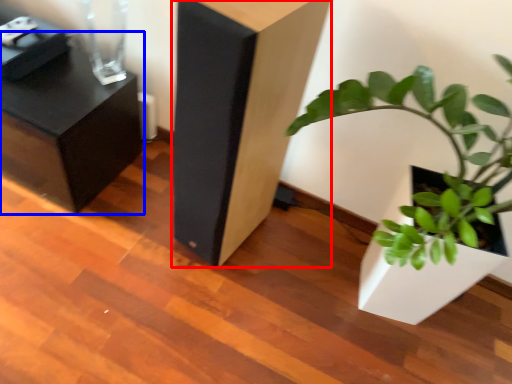
Question: Which object appears farthest to the camera in this image, furniture (highlighted by a red box) or furniture (highlighted by a blue box)?

Choices:
 (A) furniture
 (B) furniture

Answer: (B)